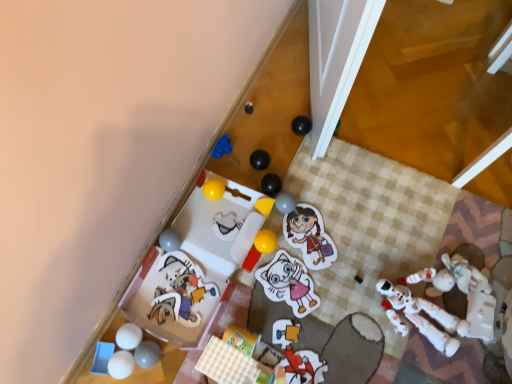
Where is `vacant area that lies between cartoon cat plush at lower left, positioned as the 5th toy in left-to-right order, and matte gray ball at lower left, acting as the fourth toy starting from the left`? vacant area that lies between cartoon cat plush at lower left, positioned as the 5th toy in left-to-right order, and matte gray ball at lower left, acting as the fourth toy starting from the left is located at coordinates (160, 338).